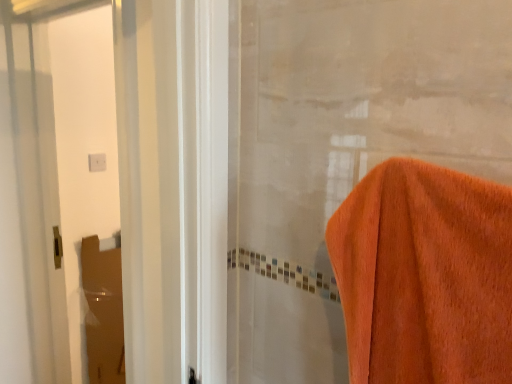
Question: Looking at their shapes, would you say brown cardboard at left, the first screen door when ordered from back to front, is wider or thinner than clear glass screen door at left, acting as the 1th screen door starting from the front?

Choices:
 (A) wide
 (B) thin

Answer: (B)

Question: Based on their positions, is brown cardboard at left, the first screen door when ordered from back to front, located to the left or right of clear glass screen door at left, the 2th screen door when ordered from back to front?

Choices:
 (A) left
 (B) right

Answer: (A)

Question: From a real-world perspective, is brown cardboard at left, the 2th screen door in the front-to-back sequence, positioned above or below clear glass screen door at left, acting as the 1th screen door starting from the front?

Choices:
 (A) below
 (B) above

Answer: (A)

Question: Is clear glass screen door at left, the 2th screen door when ordered from back to front, situated inside brown cardboard at left, the first screen door when ordered from back to front, or outside?

Choices:
 (A) inside
 (B) outside

Answer: (B)

Question: Relative to brown cardboard at left, the 2th screen door in the front-to-back sequence, is clear glass screen door at left, the 2th screen door when ordered from back to front, in front or behind?

Choices:
 (A) behind
 (B) front

Answer: (B)

Question: In terms of width, does clear glass screen door at left, acting as the 1th screen door starting from the front, look wider or thinner when compared to brown cardboard at left, the 2th screen door in the front-to-back sequence?

Choices:
 (A) thin
 (B) wide

Answer: (B)

Question: From a real-world perspective, is clear glass screen door at left, acting as the 1th screen door starting from the front, physically located above or below brown cardboard at left, the 2th screen door in the front-to-back sequence?

Choices:
 (A) above
 (B) below

Answer: (A)